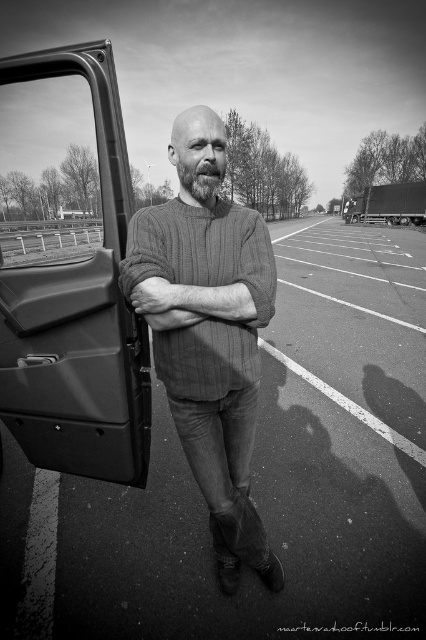
You are a delivery driver who needs to park your vehicle between the matte plastic car door at left and the metallic truck at upper right. Can you fit your 2.5 meter long delivery van in the space between them?

The matte plastic car door at left is positioned on the left side of metallic truck at upper right, but the distance between them isn not specified. Without knowing the exact width of the space, it is impossible to determine if the 2.5 meter long delivery van will fit.

Where is the knitted sweater at center located in the image?

The knitted sweater at center is located at point (210, 353) in the image.